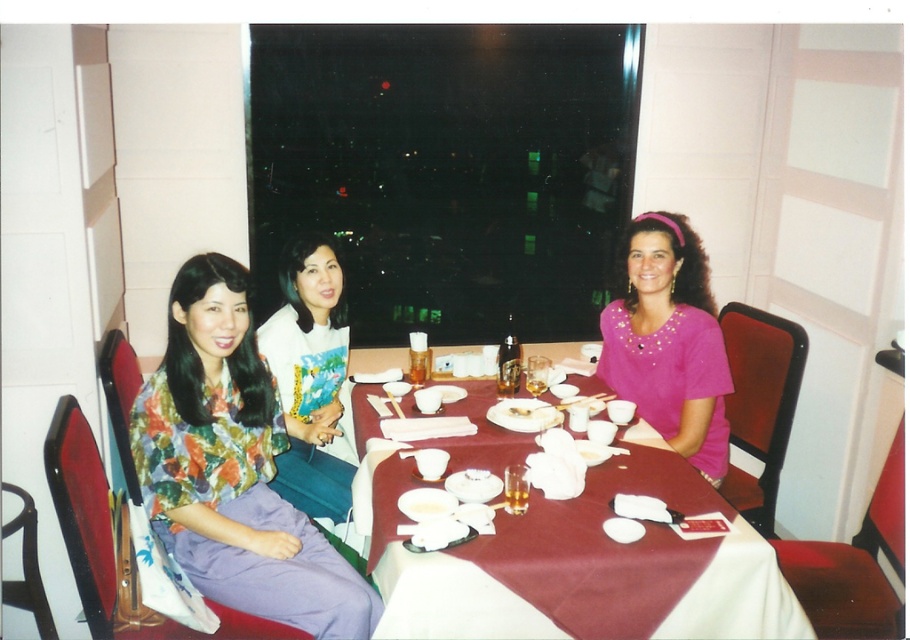
You are a server at a restaurant and need to place a new menu on the table. The menu is the same size as the floral fabric blouse at center. Can you fit it on the maroon fabric table at center without overlapping any existing items?

The maroon fabric table at center is larger in size than the floral fabric blouse at center. Since the menu is the same size as the floral fabric blouse at center, there should be enough space on the maroon fabric table at center to place the menu without overlapping existing items.

You are a waiter in a restaurant and need to place a small dessert plate between the two points on the table. The first point is point (360, 614) and the second point is point (615, 310). Which point should you place the dessert plate closer to so that it is between them?

The dessert plate should be placed closer to point (615, 310) because point (360, 614) is in front of point (615, 310), meaning the dessert plate should be positioned between them by being closer to the point that is further back.

You are a server in a restaurant and need to place a 16 inch wide dessert plate between the maroon fabric table at center and the floral fabric blouse at center. Will the dessert plate fit in the space between them?

The distance between the maroon fabric table at center and the floral fabric blouse at center is 17.04 inches, so the 16 inch wide dessert plate will fit in the space between them.